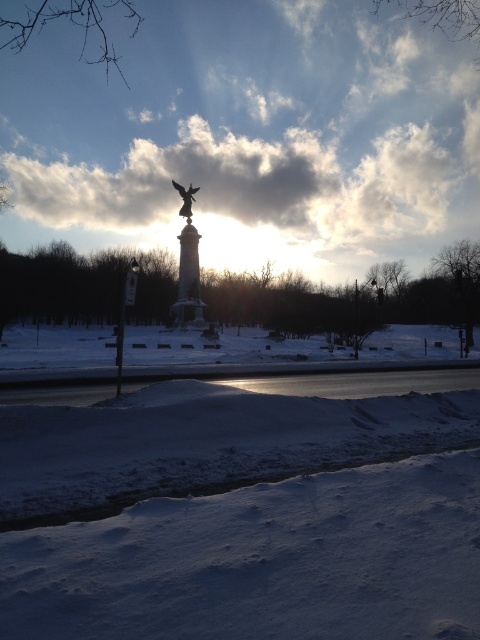
Question: Does cloudy sky at upper center have a greater width compared to sculpted gold angel at center?

Choices:
 (A) no
 (B) yes

Answer: (B)

Question: Based on their relative distances, which object is nearer to the smooth stone pillar at center?

Choices:
 (A) white powdery snow at center
 (B) white fluffy cloud at upper center

Answer: (A)

Question: Which point is farther to the camera?

Choices:
 (A) (189, 193)
 (B) (412, 120)
 (C) (120, 323)
 (D) (181, 268)

Answer: (B)

Question: Among these objects, which one is nearest to the camera?

Choices:
 (A) cloudy sky at upper center
 (B) metallic pole at left
 (C) white fluffy cloud at upper center
 (D) white powdery snow at center

Answer: (D)

Question: Can you confirm if white powdery snow at center is positioned to the right of cloudy sky at upper center?

Choices:
 (A) no
 (B) yes

Answer: (B)

Question: Does white fluffy cloud at upper center have a greater width compared to metallic pole at left?

Choices:
 (A) no
 (B) yes

Answer: (B)